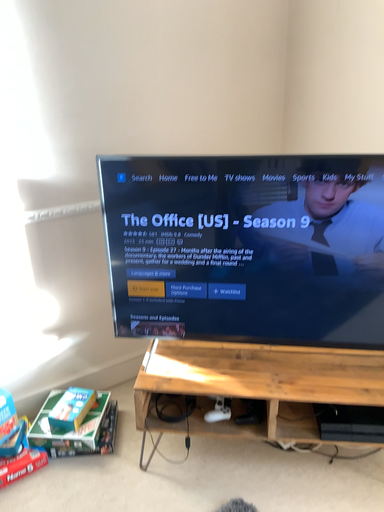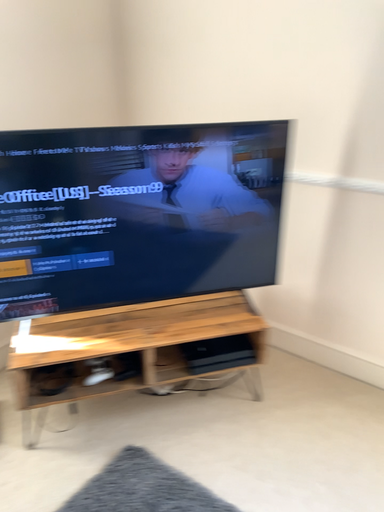
Question: Which way did the camera rotate in the video?

Choices:
 (A) rotated left
 (B) rotated right

Answer: (B)